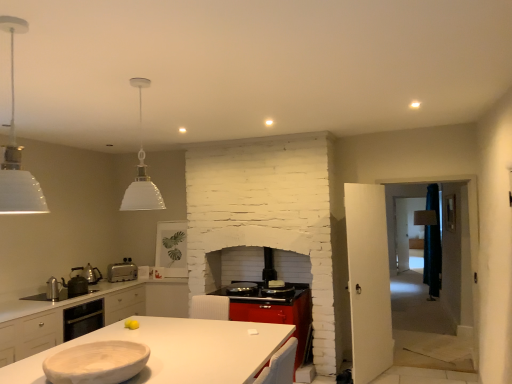
Question: Does metallic silver kettle at left, the 1th appliance in the front-to-back sequence, appear on the left side of white matte pendant light at upper left, the second light fixture when ordered from back to front?

Choices:
 (A) no
 (B) yes

Answer: (B)

Question: From a real-world perspective, is metallic silver kettle at left, the 1th appliance in the front-to-back sequence, positioned over white matte pendant light at upper left, the second light fixture when ordered from back to front, based on gravity?

Choices:
 (A) yes
 (B) no

Answer: (B)

Question: Considering the relative sizes of metallic silver kettle at left, the 3th appliance from the back, and white matte pendant light at upper left, the first light fixture positioned from the front, in the image provided, is metallic silver kettle at left, the 3th appliance from the back, smaller than white matte pendant light at upper left, the first light fixture positioned from the front,?

Choices:
 (A) yes
 (B) no

Answer: (A)

Question: From the image's perspective, would you say metallic silver kettle at left, the 1th appliance in the front-to-back sequence, is shown under white matte pendant light at upper left, the first light fixture positioned from the front?

Choices:
 (A) yes
 (B) no

Answer: (A)

Question: Are metallic silver kettle at left, the 3th appliance from the back, and white matte pendant light at upper left, the second light fixture when ordered from back to front, located far from each other?

Choices:
 (A) no
 (B) yes

Answer: (B)

Question: Is white glass pendant lamp at upper center, the 2th light fixture viewed from the front, wider or thinner than silver metallic toaster at lower left?

Choices:
 (A) wide
 (B) thin

Answer: (A)

Question: Do you think white glass pendant lamp at upper center, which is the 1th light fixture from back to front, is within silver metallic toaster at lower left, or outside of it?

Choices:
 (A) inside
 (B) outside

Answer: (B)

Question: Looking at the image, does white glass pendant lamp at upper center, the 2th light fixture viewed from the front, seem bigger or smaller compared to silver metallic toaster at lower left?

Choices:
 (A) big
 (B) small

Answer: (A)

Question: Is point (159, 200) closer or farther from the camera than point (119, 279)?

Choices:
 (A) closer
 (B) farther

Answer: (A)

Question: From the image's perspective, relative to metallic silver kettle at left, the 1th appliance in the front-to-back sequence, is white glass pendant lamp at upper center, the 2th light fixture viewed from the front, above or below?

Choices:
 (A) above
 (B) below

Answer: (A)

Question: From a real-world perspective, relative to metallic silver kettle at left, the 3th appliance from the back, is white glass pendant lamp at upper center, which is the 1th light fixture from back to front, vertically above or below?

Choices:
 (A) above
 (B) below

Answer: (A)

Question: Looking at the image, does white glass pendant lamp at upper center, which is the 1th light fixture from back to front, seem bigger or smaller compared to metallic silver kettle at left, the 1th appliance in the front-to-back sequence?

Choices:
 (A) small
 (B) big

Answer: (B)

Question: In the image, is white glass pendant lamp at upper center, which is the 1th light fixture from back to front, positioned in front of or behind metallic silver kettle at left, the 1th appliance in the front-to-back sequence?

Choices:
 (A) front
 (B) behind

Answer: (A)

Question: In terms of width, does white glass pendant lamp at upper center, which is the 1th light fixture from back to front, look wider or thinner when compared to white matte countertop at center?

Choices:
 (A) wide
 (B) thin

Answer: (B)

Question: In terms of height, does white glass pendant lamp at upper center, which is the 1th light fixture from back to front, look taller or shorter compared to white matte countertop at center?

Choices:
 (A) tall
 (B) short

Answer: (A)